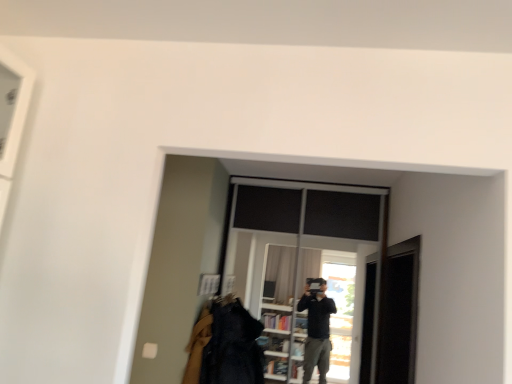
What do you see at coordinates (398, 314) in the screenshot? The height and width of the screenshot is (384, 512). I see `transparent glass screen door at right` at bounding box center [398, 314].

The image size is (512, 384). What do you see at coordinates (294, 249) in the screenshot? I see `transparent glass window at center` at bounding box center [294, 249].

What are the coordinates of `transparent glass screen door at right` in the screenshot? It's located at (398, 314).

Can you confirm if denim jacket at lower center is bigger than transparent glass window at center?

No.

Is denim jacket at lower center not within transparent glass window at center?

Yes.

Considering the positions of objects denim jacket at lower center and transparent glass window at center in the image provided, who is behind, denim jacket at lower center or transparent glass window at center?

transparent glass window at center.

Image resolution: width=512 pixels, height=384 pixels. What are the coordinates of `clothing beneath the transparent glass window at center (from a real-world perspective)` in the screenshot? It's located at (232, 346).

Measure the distance between transparent glass screen door at right and denim jacket at lower center.

A distance of 1.02 meters exists between transparent glass screen door at right and denim jacket at lower center.

From the image's perspective, which is above, transparent glass screen door at right or denim jacket at lower center?

transparent glass screen door at right.

From a real-world perspective, relative to denim jacket at lower center, is transparent glass screen door at right vertically above or below?

In terms of real-world spatial position, transparent glass screen door at right is above denim jacket at lower center.

Based on their positions, is transparent glass screen door at right located to the left or right of denim jacket at lower center?

Clearly, transparent glass screen door at right is on the right of denim jacket at lower center in the image.

Locate an element on the screen. screen door on the right of transparent glass window at center is located at coordinates (398, 314).

Can you confirm if transparent glass screen door at right is wider than transparent glass window at center?

Yes, transparent glass screen door at right is wider than transparent glass window at center.

Which of these two, transparent glass screen door at right or transparent glass window at center, stands shorter?

transparent glass screen door at right.

Who is smaller, transparent glass screen door at right or transparent glass window at center?

transparent glass screen door at right.

From a real-world perspective, is transparent glass window at center physically below transparent glass screen door at right?

Actually, transparent glass window at center is physically above transparent glass screen door at right in the real world.

Considering the relative sizes of transparent glass window at center and transparent glass screen door at right in the image provided, is transparent glass window at center smaller than transparent glass screen door at right?

Actually, transparent glass window at center might be larger than transparent glass screen door at right.

Is point (281, 252) less distant than point (404, 307)?

No, it is behind (404, 307).

In the scene shown: Is transparent glass window at center thinner than transparent glass screen door at right?

Indeed, transparent glass window at center has a lesser width compared to transparent glass screen door at right.

Is transparent glass window at center oriented away from denim jacket at lower center?

Yes.

Considering the relative positions of transparent glass window at center and denim jacket at lower center in the image provided, is transparent glass window at center to the left or to the right of denim jacket at lower center?

transparent glass window at center is to the right of denim jacket at lower center.

Is transparent glass window at center surrounding denim jacket at lower center?

Definitely not — denim jacket at lower center is not inside transparent glass window at center.

Which is more to the right, denim jacket at lower center or transparent glass screen door at right?

Positioned to the right is transparent glass screen door at right.

Does point (209, 345) come farther from viewer compared to point (395, 369)?

No, (209, 345) is closer to viewer.

The width and height of the screenshot is (512, 384). Find the location of `screen door that appears above the denim jacket at lower center (from the image's perspective)`. screen door that appears above the denim jacket at lower center (from the image's perspective) is located at coordinates (398, 314).

Considering the relative sizes of denim jacket at lower center and transparent glass screen door at right in the image provided, is denim jacket at lower center bigger than transparent glass screen door at right?

No, denim jacket at lower center is not bigger than transparent glass screen door at right.

There is a denim jacket at lower center. Identify the location of window above it (from a real-world perspective). (294, 249).

Locate an element on the screen. Image resolution: width=512 pixels, height=384 pixels. clothing lying below the transparent glass screen door at right (from the image's perspective) is located at coordinates point(232,346).

From the picture: Estimate the real-world distances between objects in this image. Which object is further from denim jacket at lower center, transparent glass screen door at right or transparent glass window at center?

Among the two, transparent glass screen door at right is located further to denim jacket at lower center.

Estimate the real-world distances between objects in this image. Which object is further from transparent glass screen door at right, transparent glass window at center or denim jacket at lower center?

denim jacket at lower center.

Looking at the image, which one is located closer to transparent glass screen door at right, denim jacket at lower center or transparent glass window at center?

transparent glass window at center is positioned closer to the anchor transparent glass screen door at right.

Estimate the real-world distances between objects in this image. Which object is further from transparent glass window at center, transparent glass screen door at right or denim jacket at lower center?

transparent glass screen door at right is further to transparent glass window at center.

From the image, which object appears to be farther from transparent glass window at center, denim jacket at lower center or transparent glass screen door at right?

transparent glass screen door at right is further to transparent glass window at center.

Based on their spatial positions, is transparent glass window at center or transparent glass screen door at right closer to denim jacket at lower center?

transparent glass window at center lies closer to denim jacket at lower center than the other object.

Locate an element on the screen. The height and width of the screenshot is (384, 512). window situated between denim jacket at lower center and transparent glass screen door at right from left to right is located at coordinates (294, 249).